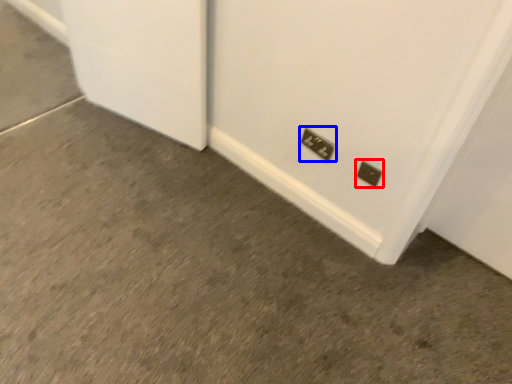
Question: Which object is further to the camera taking this photo, power plugs and sockets (highlighted by a red box) or power plugs and sockets (highlighted by a blue box)?

Choices:
 (A) power plugs and sockets
 (B) power plugs and sockets

Answer: (B)